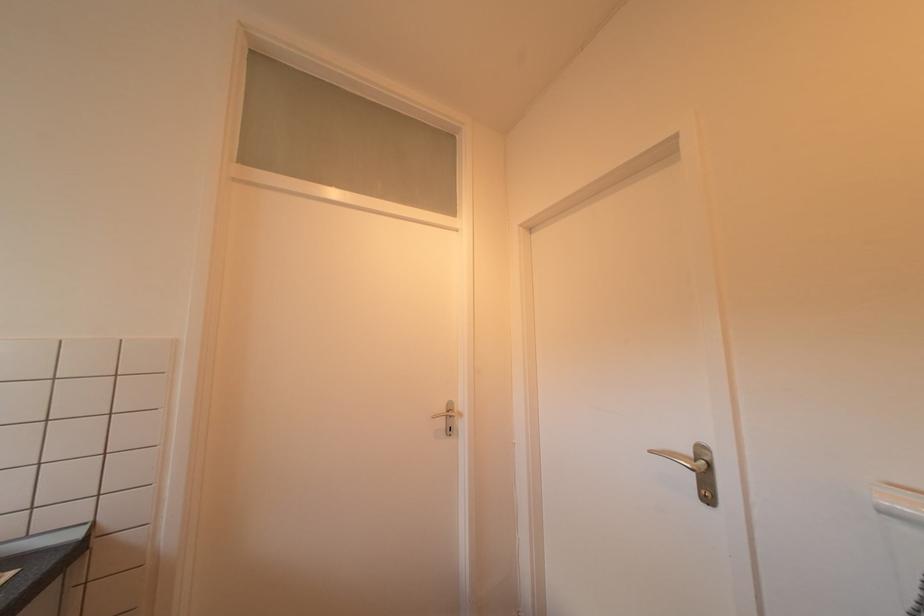
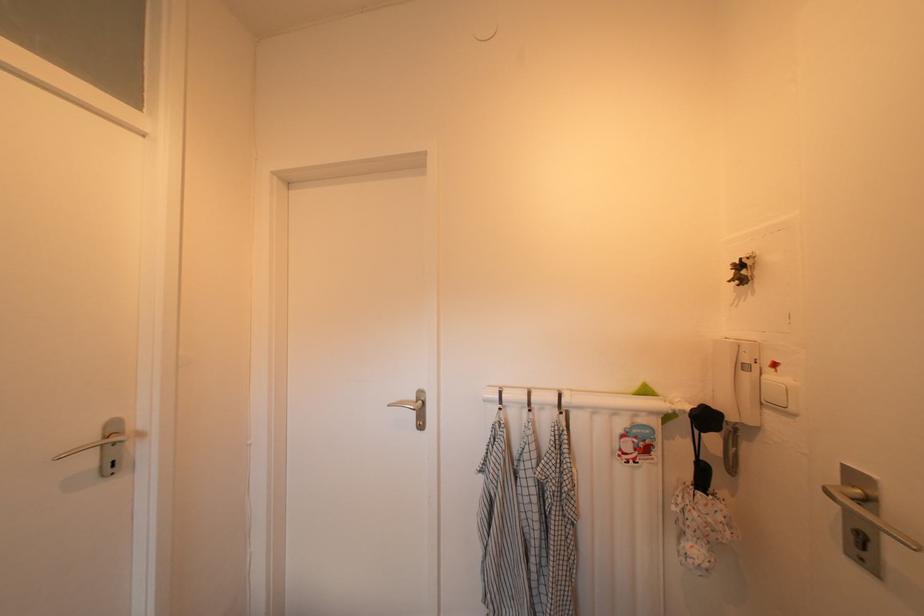
Question: Based on the continuous images, in which direction is the camera rotating? Reply with the corresponding letter.

Choices:
 (A) Left
 (B) Right
 (C) Up
 (D) Down

Answer: (B)